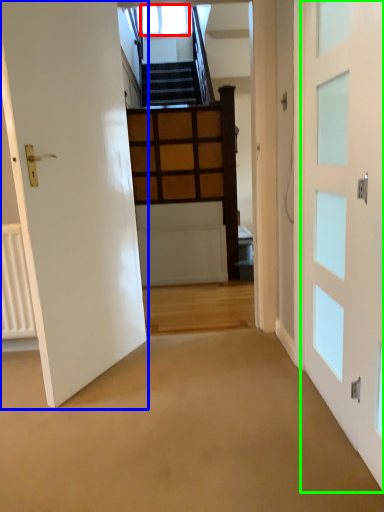
Question: Estimate the real-world distances between objects in this image. Which object is farther from window (highlighted by a red box), door (highlighted by a blue box) or door (highlighted by a green box)?

Choices:
 (A) door
 (B) door

Answer: (B)